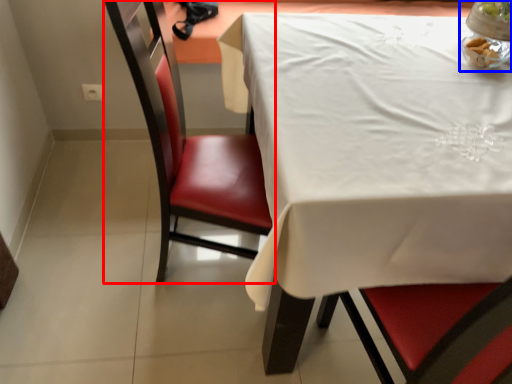
Question: Which object appears closest to the camera in this image, chair (highlighted by a red box) or tableware (highlighted by a blue box)?

Choices:
 (A) chair
 (B) tableware

Answer: (A)